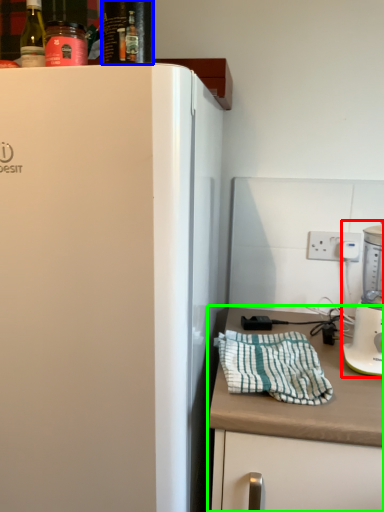
Question: Estimate the real-world distances between objects in this image. Which object is farther from blender (highlighted by a red box), beverage (highlighted by a blue box) or countertop (highlighted by a green box)?

Choices:
 (A) beverage
 (B) countertop

Answer: (A)